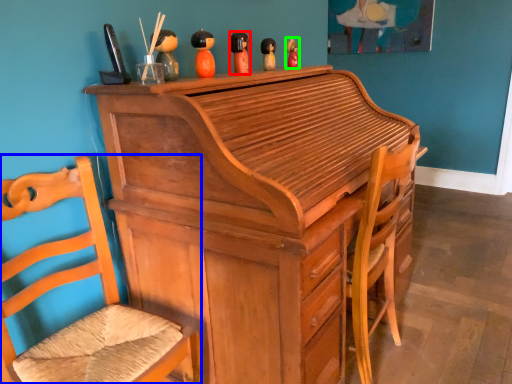
Question: Which object is positioned closest to toy (highlighted by a red box)? Select from chair (highlighted by a blue box) and toy (highlighted by a green box).

Choices:
 (A) chair
 (B) toy

Answer: (B)